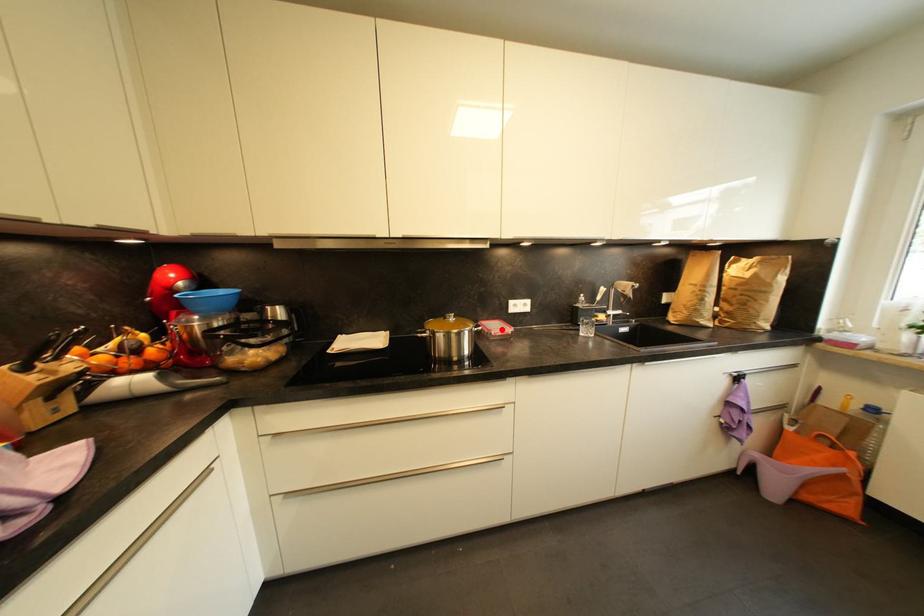
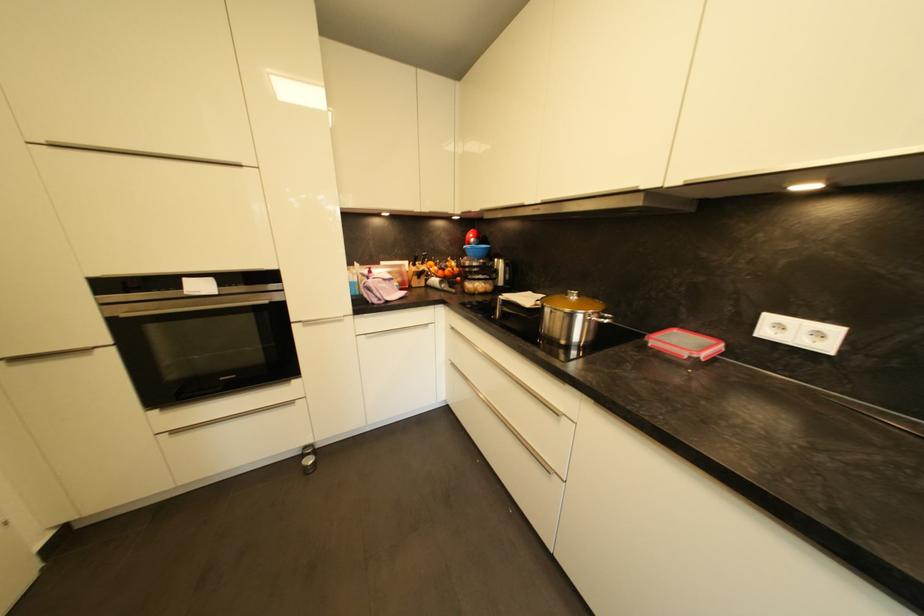
Find the pixel in the second image that matches the highlighted location in the first image.

(686, 345)